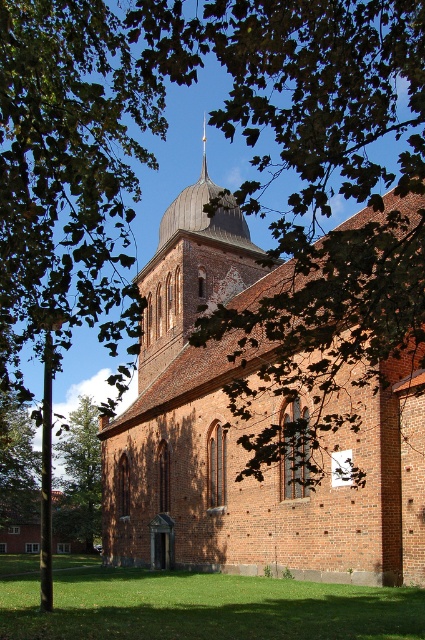
Based on the photo, you are standing in front of the historic brick church and want to determine the relative positions of two points marked on the structure. The first point is at coordinates point (68, 515) and the second is at point (204, 177). Which point is closer to you?

Point (68, 515) is closer to you because it is further to the viewer than point (204, 177).

You are a photographer planning to capture the brown brick church at center and the green leafy tree at lower left in a single shot. Based on their sizes, which object should you focus on to ensure both are clearly visible in the frame?

The brown brick church at center is bigger than the green leafy tree at lower left, so focusing on the brown brick church at center would ensure both are clearly visible as the larger object can dominate the frame while still allowing space for the smaller tree.